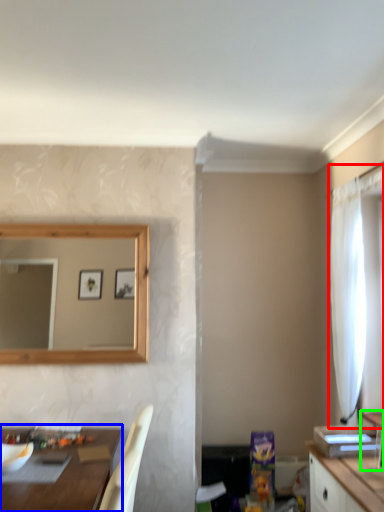
Question: Which object is positioned closest to curtain (highlighted by a red box)? Select from table (highlighted by a blue box) and vanity (highlighted by a green box).

Choices:
 (A) table
 (B) vanity

Answer: (B)